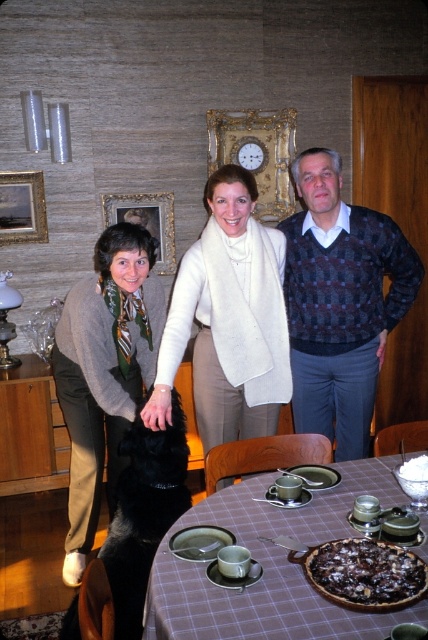
Question: Which object appears closest to the camera in this image?

Choices:
 (A) plaid fabric table at center
 (B) matte beige sweater at center

Answer: (A)

Question: Which point is farther to the camera?

Choices:
 (A) matte gray sweater at left
 (B) chocolate cake at center

Answer: (A)

Question: Does matte gray sweater at left have a larger size compared to black fur dog at lower left?

Choices:
 (A) yes
 (B) no

Answer: (A)

Question: Estimate the real-world distances between objects in this image. Which object is closer to the matte beige sweater at center?

Choices:
 (A) chocolate cake at center
 (B) white knitted scarf at center

Answer: (B)

Question: Is plaid sweater at center wider than plaid fabric table at center?

Choices:
 (A) yes
 (B) no

Answer: (B)

Question: Can you confirm if white knitted scarf at center is positioned to the left of plaid fabric table at center?

Choices:
 (A) no
 (B) yes

Answer: (B)